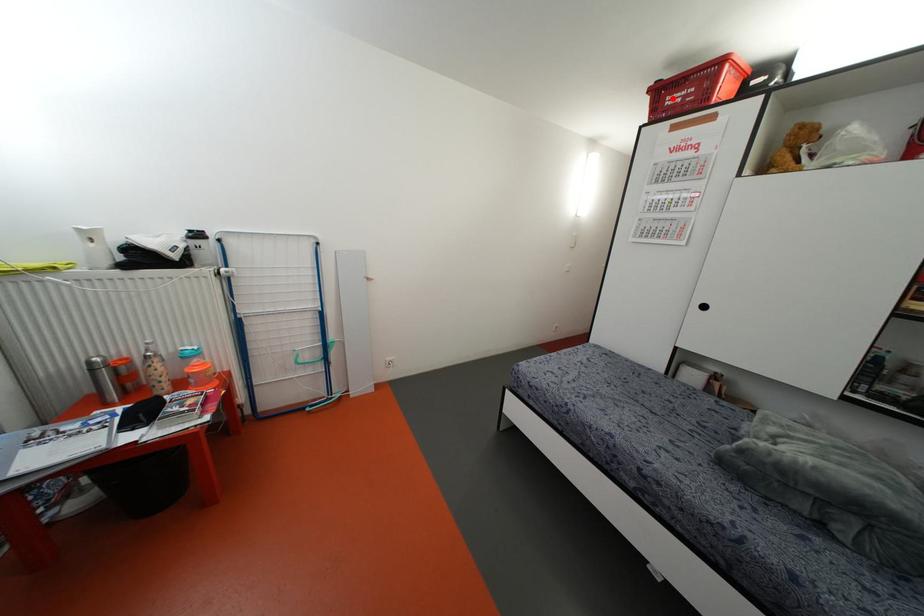
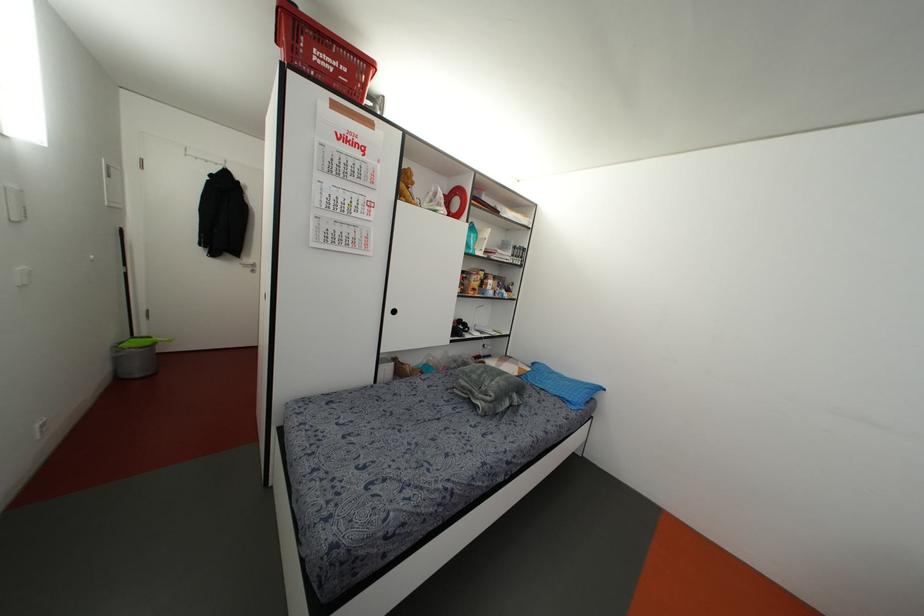
Locate, in the second image, the point that corresponds to the highlighted location in the first image.

(322, 59)